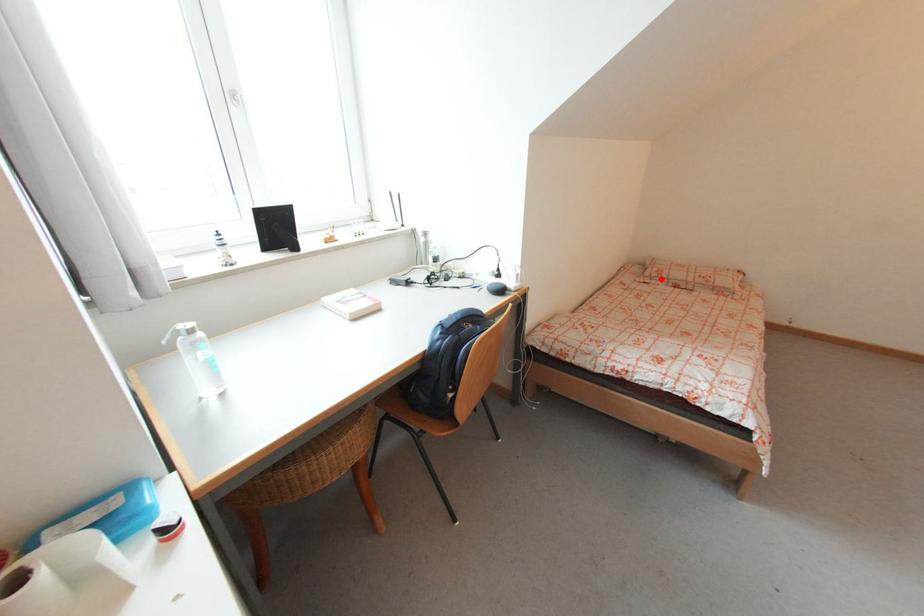
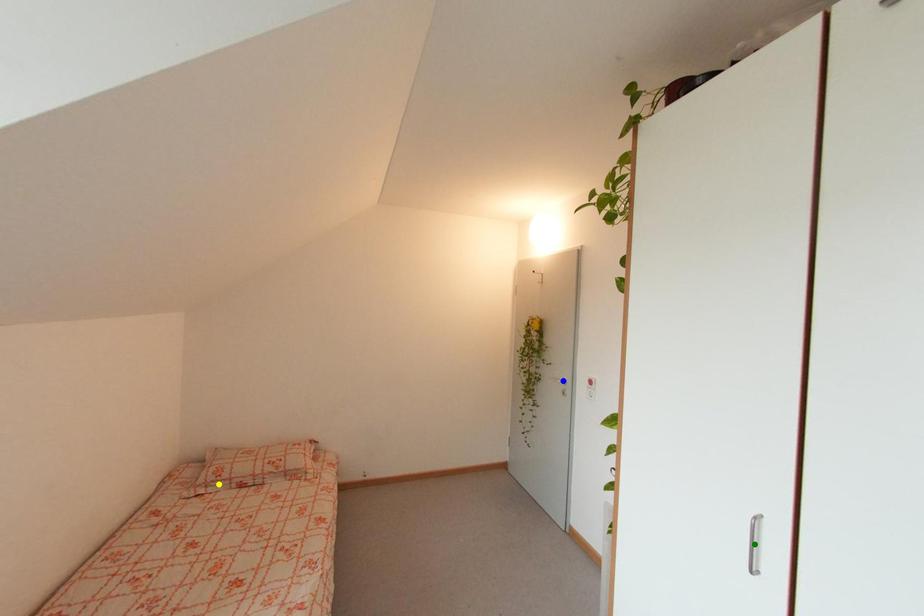
Question: I am providing you with two images of the same scene from different viewpoints. A red point is marked on the first image. You are given multiple points on the second image. Can you choose the point in image 2 that corresponds to the point in image 1?

Choices:
 (A) green point
 (B) blue point
 (C) yellow point

Answer: (C)